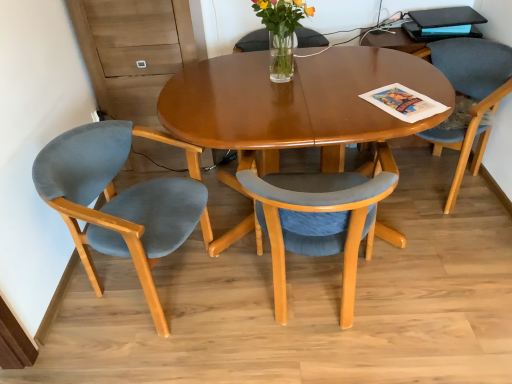
Question: Is matte blue chair at left, which ranks as the 1th chair in left-to-right order, further to the viewer compared to clear glass vase at center?

Choices:
 (A) yes
 (B) no

Answer: (B)

Question: From the image's perspective, is matte blue chair at left, which ranks as the 1th chair in left-to-right order, located beneath clear glass vase at center?

Choices:
 (A) no
 (B) yes

Answer: (B)

Question: Does matte blue chair at left, which ranks as the 1th chair in left-to-right order, have a greater width compared to clear glass vase at center?

Choices:
 (A) yes
 (B) no

Answer: (A)

Question: From a real-world perspective, does matte blue chair at left, which ranks as the 1th chair in left-to-right order, stand above clear glass vase at center?

Choices:
 (A) no
 (B) yes

Answer: (A)

Question: Can you confirm if matte blue chair at left, marked as the third chair in a right-to-left arrangement, is smaller than clear glass vase at center?

Choices:
 (A) yes
 (B) no

Answer: (B)

Question: From the image's perspective, is gray fabric chair at right, the third chair in the left-to-right sequence, located above or below translucent glass vase at center?

Choices:
 (A) above
 (B) below

Answer: (B)

Question: Considering the relative positions of gray fabric chair at right, the third chair in the left-to-right sequence, and translucent glass vase at center in the image provided, is gray fabric chair at right, the third chair in the left-to-right sequence, to the left or to the right of translucent glass vase at center?

Choices:
 (A) left
 (B) right

Answer: (B)

Question: In the image, is gray fabric chair at right, the third chair in the left-to-right sequence, positioned in front of or behind translucent glass vase at center?

Choices:
 (A) behind
 (B) front

Answer: (A)

Question: Is gray fabric chair at right, the 1th chair viewed from the right, inside or outside of translucent glass vase at center?

Choices:
 (A) outside
 (B) inside

Answer: (A)

Question: Considering the positions of matte blue fabric chair at center, acting as the 2th chair starting from the right, and blue glossy magazine at upper right in the image, is matte blue fabric chair at center, acting as the 2th chair starting from the right, taller or shorter than blue glossy magazine at upper right?

Choices:
 (A) tall
 (B) short

Answer: (A)

Question: In the image, is matte blue fabric chair at center, acting as the 2th chair starting from the right, on the left side or the right side of blue glossy magazine at upper right?

Choices:
 (A) right
 (B) left

Answer: (B)

Question: From the image's perspective, is matte blue fabric chair at center, which is counted as the second chair, starting from the left, above or below blue glossy magazine at upper right?

Choices:
 (A) below
 (B) above

Answer: (A)

Question: Is matte blue fabric chair at center, acting as the 2th chair starting from the right, in front of or behind blue glossy magazine at upper right in the image?

Choices:
 (A) behind
 (B) front

Answer: (B)

Question: Visually, is blue glossy magazine at upper right positioned to the left or to the right of clear glass vase at center?

Choices:
 (A) left
 (B) right

Answer: (B)

Question: Is blue glossy magazine at upper right bigger or smaller than clear glass vase at center?

Choices:
 (A) big
 (B) small

Answer: (A)